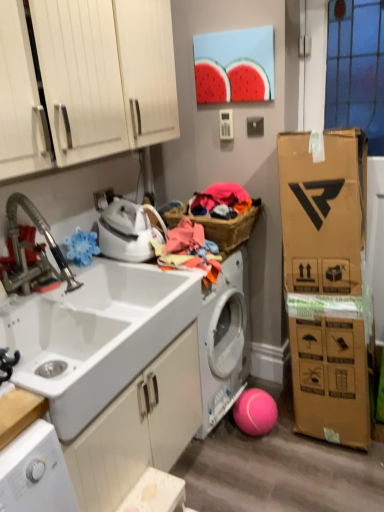
Question: Is white glossy iron at upper left wider than white glossy cabinet doors at upper left, arranged as the 2th cabinetry when ordered from the bottom?

Choices:
 (A) yes
 (B) no

Answer: (B)

Question: Is white glossy iron at upper left oriented towards white glossy cabinet doors at upper left, arranged as the 2th cabinetry when ordered from the bottom?

Choices:
 (A) no
 (B) yes

Answer: (A)

Question: Does white glossy iron at upper left have a lesser width compared to white glossy cabinet doors at upper left, positioned as the 1th cabinetry in top-to-bottom order?

Choices:
 (A) no
 (B) yes

Answer: (B)

Question: Is white glossy iron at upper left outside white glossy cabinet doors at upper left, positioned as the 1th cabinetry in top-to-bottom order?

Choices:
 (A) no
 (B) yes

Answer: (B)

Question: Is white glossy iron at upper left next to white glossy cabinet doors at upper left, positioned as the 1th cabinetry in top-to-bottom order, and touching it?

Choices:
 (A) yes
 (B) no

Answer: (B)

Question: Is white glossy iron at upper left to the left of white glossy cabinet doors at upper left, positioned as the 1th cabinetry in top-to-bottom order, from the viewer's perspective?

Choices:
 (A) yes
 (B) no

Answer: (B)

Question: Can you confirm if multicolored fabric at center is wider than white glossy iron at upper left?

Choices:
 (A) no
 (B) yes

Answer: (A)

Question: Considering the relative sizes of multicolored fabric at center and white glossy iron at upper left in the image provided, is multicolored fabric at center thinner than white glossy iron at upper left?

Choices:
 (A) no
 (B) yes

Answer: (B)

Question: Is the surface of multicolored fabric at center in direct contact with white glossy iron at upper left?

Choices:
 (A) yes
 (B) no

Answer: (B)

Question: Is multicolored fabric at center further to camera compared to white glossy iron at upper left?

Choices:
 (A) yes
 (B) no

Answer: (B)

Question: Is multicolored fabric at center not inside white glossy iron at upper left?

Choices:
 (A) no
 (B) yes

Answer: (B)

Question: Is multicolored fabric at center surrounding white glossy iron at upper left?

Choices:
 (A) no
 (B) yes

Answer: (A)

Question: Is white matte cabinet at lower center, the first cabinetry positioned from the bottom, oriented towards white glossy iron at upper left?

Choices:
 (A) yes
 (B) no

Answer: (B)